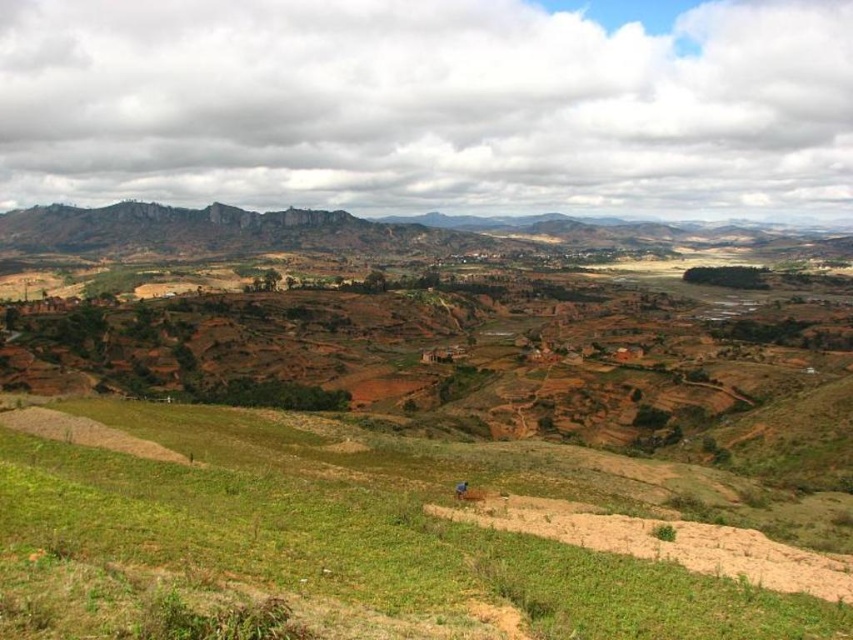
Question: Can you confirm if green grassy field at lower center is positioned above blue fabric person at center?

Choices:
 (A) yes
 (B) no

Answer: (A)

Question: Which point appears closest to the camera in this image?

Choices:
 (A) (126, 528)
 (B) (456, 496)

Answer: (A)

Question: Can you confirm if green grassy field at lower center is positioned to the left of blue fabric person at center?

Choices:
 (A) yes
 (B) no

Answer: (A)

Question: Does green grassy field at lower center have a larger size compared to blue fabric person at center?

Choices:
 (A) no
 (B) yes

Answer: (B)